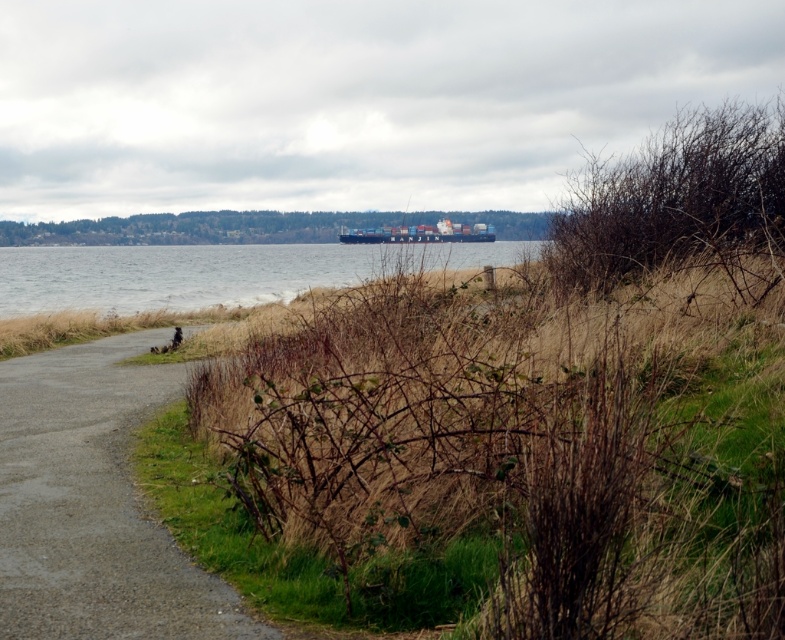
You are standing on the gray asphalt path at lower left and want to reach the blue matte container ship at center. Which direction should you walk to get closer to the ship?

The gray asphalt path at lower left is below the blue matte container ship at center, so you should walk upwards or towards the center to get closer to the ship.

Based on the photo, you are standing at the center of the image and want to walk to the gray asphalt path at lower left. Based on its position, in which general direction should you head?

The gray asphalt path at lower left is located at point [93,504], so you should head towards the lower left direction to reach it.